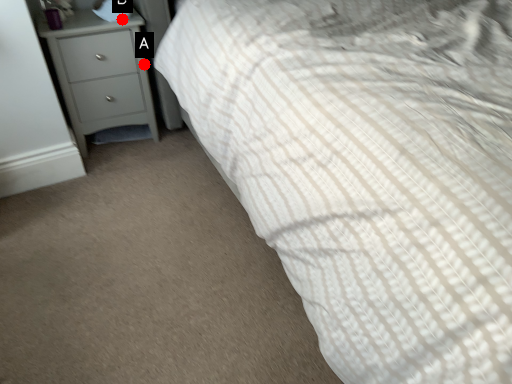
Question: Two points are circled on the image, labeled by A and B beside each circle. Among these points, which one is farthest from the camera?

Choices:
 (A) A is further
 (B) B is further

Answer: (A)